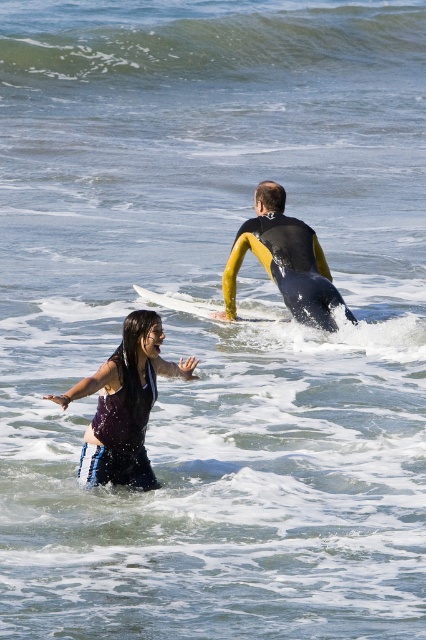
Question: Is dark purple wetsuit at center thinner than yellow neoprene wetsuit at center?

Choices:
 (A) no
 (B) yes

Answer: (B)

Question: Which point is closer to the camera?

Choices:
 (A) dark purple wetsuit at center
 (B) yellow neoprene wetsuit at center
 (C) shiny purple wetsuit at lower left

Answer: (C)

Question: Which object is positioned farthest from the shiny purple wetsuit at lower left?

Choices:
 (A) white foam surfboard at center
 (B) greenish-blue water at upper center

Answer: (B)

Question: In this image, where is greenish-blue water at upper center located relative to white foam surfboard at center?

Choices:
 (A) below
 (B) above

Answer: (B)

Question: Which is farther from the dark purple wetsuit at center?

Choices:
 (A) yellow neoprene wetsuit at center
 (B) shiny purple wetsuit at lower left
 (C) white foam surfboard at center
 (D) greenish-blue water at upper center

Answer: (D)

Question: Is greenish-blue water at upper center to the right of white foam surfboard at center from the viewer's perspective?

Choices:
 (A) no
 (B) yes

Answer: (B)